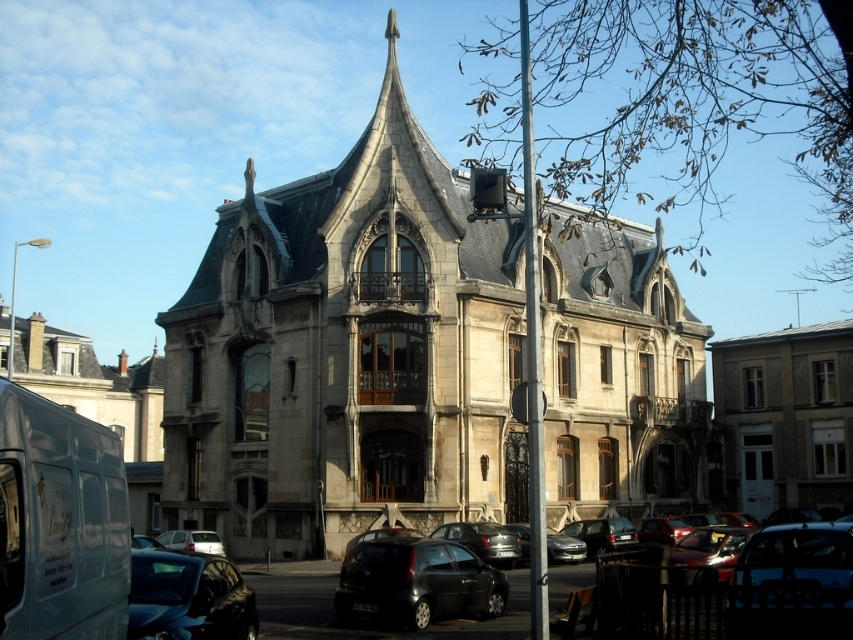
How distant is white matte van at lower left from white stone church at left?

They are 90.87 meters apart.

The image size is (853, 640). I want to click on white matte van at lower left, so click(61, 522).

Does point (80, 595) come closer to viewer compared to point (67, 346)?

Yes, point (80, 595) is in front of point (67, 346).

Where is `white matte van at lower left`? This screenshot has width=853, height=640. white matte van at lower left is located at coordinates (61, 522).

Does stone church at center have a lesser height compared to shiny black car at center?

No.

Where is `stone church at center`? stone church at center is located at coordinates (347, 353).

Identify the location of stone church at center. (347, 353).

Which is below, white stone church at left or shiny black car at center?

shiny black car at center is below.

Does white stone church at left lie behind shiny black car at center?

That is True.

Is point (102, 401) positioned in front of point (451, 598)?

No, (102, 401) is further to viewer.

Locate an element on the screen. This screenshot has width=853, height=640. white stone church at left is located at coordinates (93, 384).